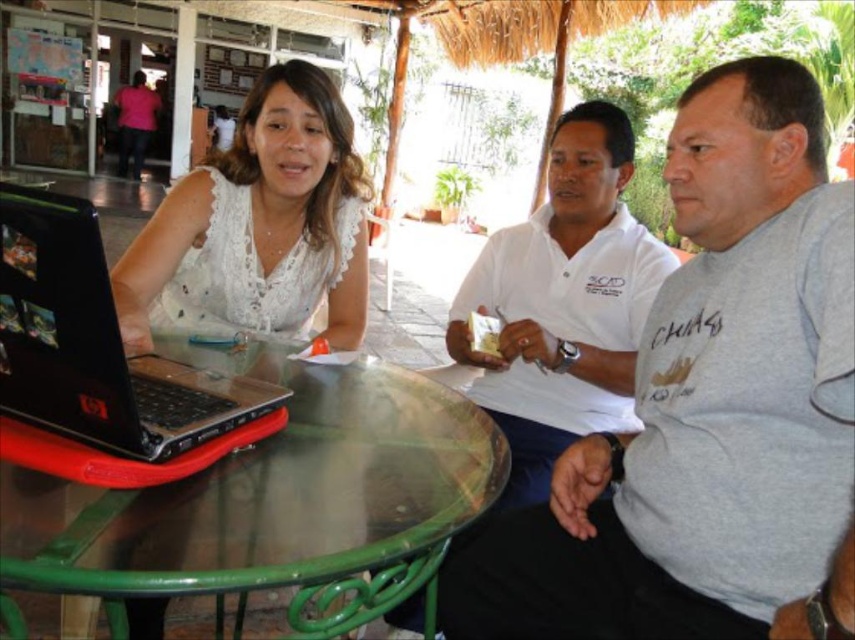
You are sitting at the transparent glass table at center and want to hand a document to the person wearing the gray cotton shirt at center. Can you reach them without getting up?

The transparent glass table at center is behind gray cotton shirt at center, so you can reach them without getting up as the table is between you and the person.

You are a delivery person trying to place a large box on the transparent glass table at center. However, the black plastic laptop at left is already occupying space on the table. Can you fit the box on the table without moving the laptop?

The transparent glass table at center is much taller than the black plastic laptop at left, so there is sufficient vertical space to place the large box on the table without moving the laptop.

You are a photographer trying to capture a group photo of the gray cotton shirt at center and the transparent glass table at center. Since the glass table might reflect the background, which object should you position closer to the camera to ensure it is clearly visible without reflections?

You should position the gray cotton shirt at center closer to the camera because it is larger in size compared to the transparent glass table at center, making it easier to focus on without reflections.